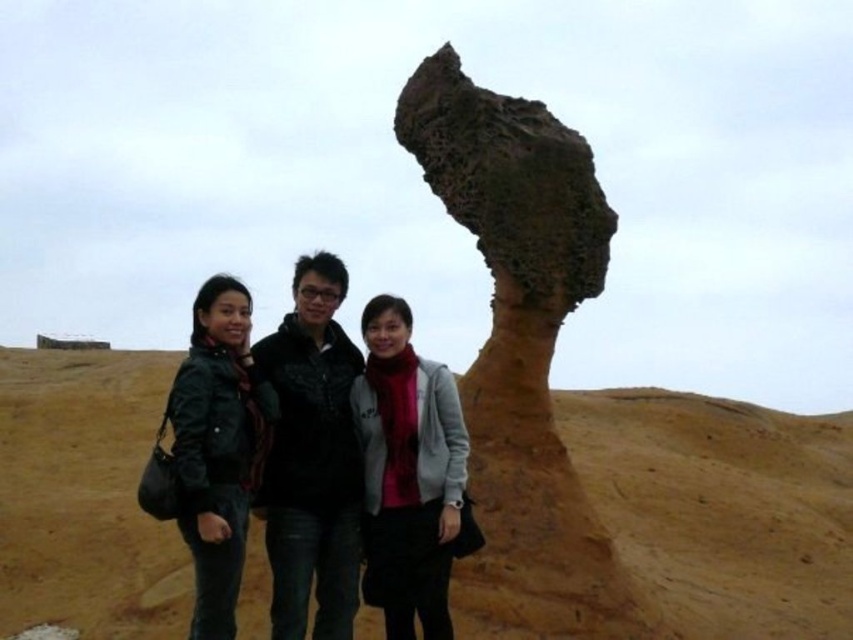
Question: Does brown sandy desert at center have a smaller size compared to leather jacket at center?

Choices:
 (A) no
 (B) yes

Answer: (A)

Question: Among these points, which one is nearest to the camera?

Choices:
 (A) (183, 381)
 (B) (306, 288)

Answer: (A)

Question: Does matte black jacket at center have a larger size compared to leather jacket at center?

Choices:
 (A) yes
 (B) no

Answer: (A)

Question: Estimate the real-world distances between objects in this image. Which object is farther from the leather jacket at center?

Choices:
 (A) rusty stone formation at center
 (B) brown sandy desert at center
 (C) matte black jacket at center
 (D) matte gray scarf at center

Answer: (B)

Question: Which point is closer to the camera?

Choices:
 (A) matte black jacket at center
 (B) leather jacket at center
 (C) black matte jacket at center
 (D) rusty stone formation at center

Answer: (A)

Question: Does rusty stone formation at center appear on the left side of leather jacket at center?

Choices:
 (A) no
 (B) yes

Answer: (A)